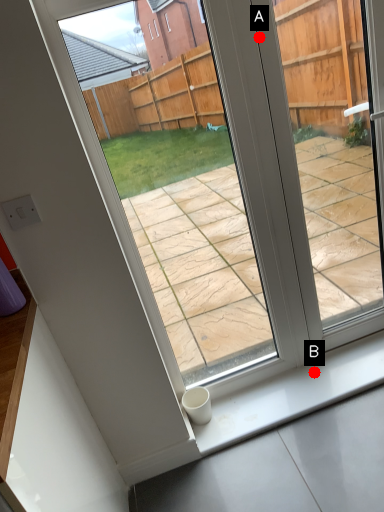
Question: Two points are circled on the image, labeled by A and B beside each circle. Which point is further to the camera?

Choices:
 (A) A is further
 (B) B is further

Answer: (B)